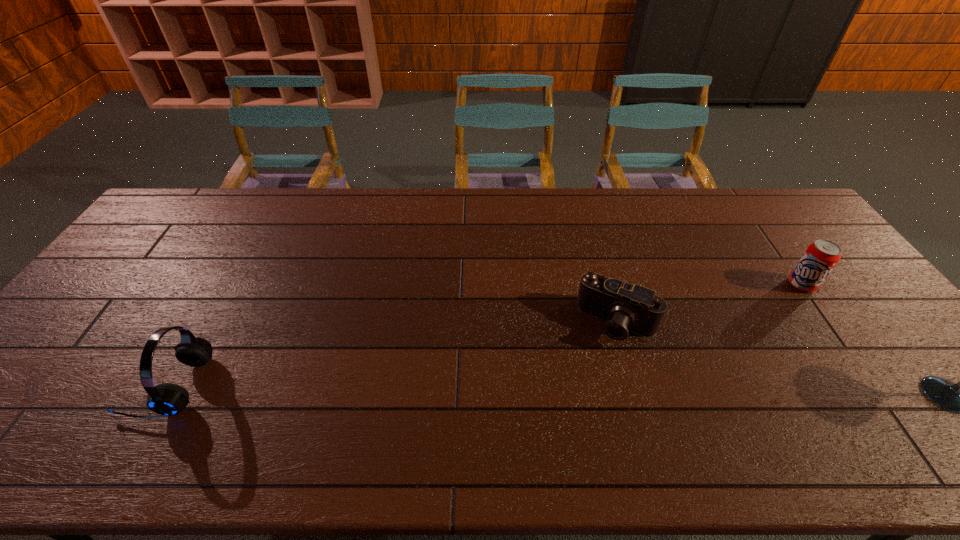
Locate an element on the screen. The image size is (960, 540). the second tallest object is located at coordinates (167, 399).

Identify the location of headset. (167, 399).

Locate an element on the screen. The width and height of the screenshot is (960, 540). the third object from right to left is located at coordinates (623, 306).

This screenshot has height=540, width=960. I want to click on the shortest object, so click(x=623, y=306).

I want to click on the farthest object, so click(x=820, y=257).

I want to click on soda can, so click(x=820, y=257).

Where is `free space located on the ear cushions of the headset`? The width and height of the screenshot is (960, 540). free space located on the ear cushions of the headset is located at coordinates (103, 386).

This screenshot has height=540, width=960. I want to click on free space located 0.190m on the ear cushions of the headset, so click(x=53, y=386).

Identify the location of free spot located on the ear cushions of the headset. Image resolution: width=960 pixels, height=540 pixels. (44, 386).

Locate an element on the screen. The image size is (960, 540). vacant space situated 0.080m on the front-facing side of the camera is located at coordinates (593, 368).